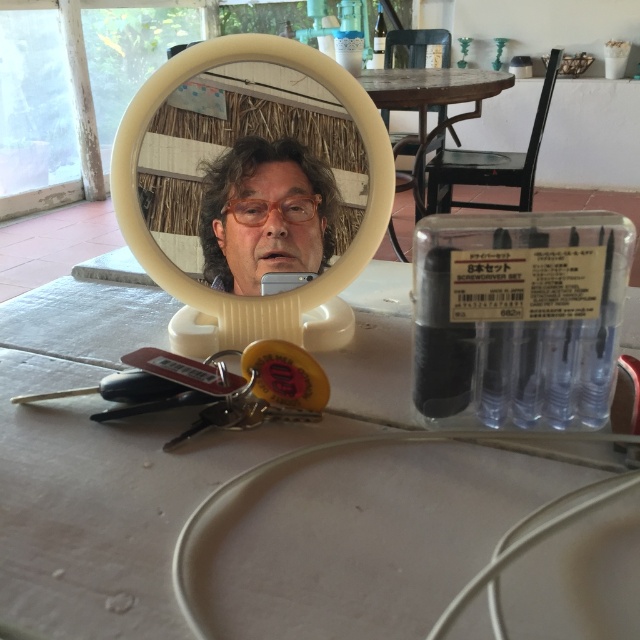
You are organizing items on the table and need to place a new object between the white matte table at center and the white plastic mirror at center. Based on their positions, where should you place the new object?

The white matte table at center is to the left of the white plastic mirror at center, so you should place the new object between them on the right side of the white matte table at center and the left side of the white plastic mirror at center.

You are organizing items on a table and need to place both the white plastic mirror at center and the matte plastic man at center. Given their sizes, which one should you place first to ensure stability?

The white plastic mirror at center is larger in size than the matte plastic man at center, so you should place the larger mirror first to provide a stable base for the smaller man.

You are trying to place a small object on the table. Which object, the white matte table at center or the matte plastic man at center, is closer to you where you can place the object more easily?

The white matte table at center is closer to the viewer than the matte plastic man at center, so you can place the object more easily on the white matte table at center.